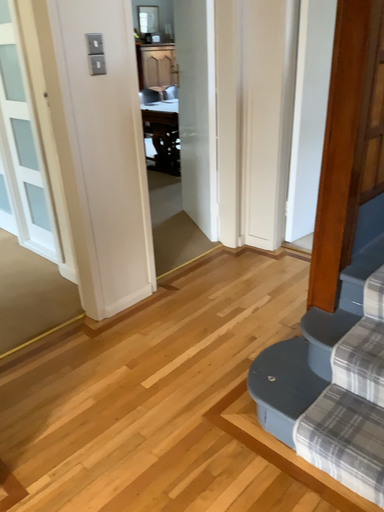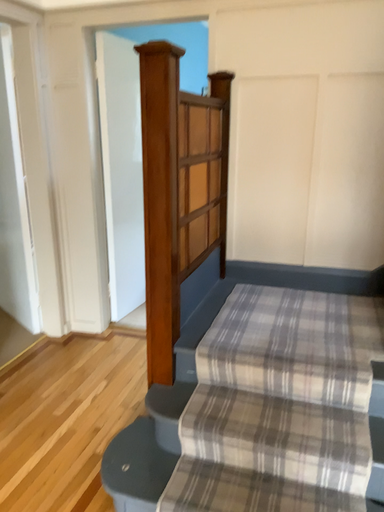
Question: Which way did the camera rotate in the video?

Choices:
 (A) rotated downward
 (B) rotated upward

Answer: (B)